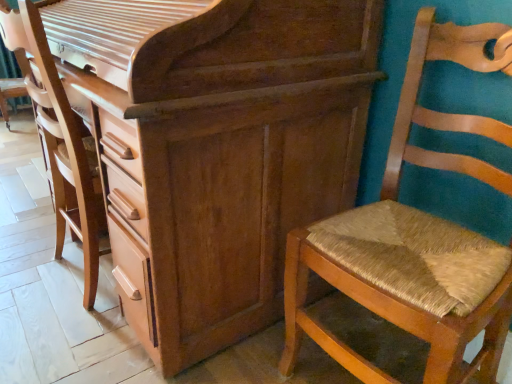
Question: Is woven straw chair at right bigger or smaller than wooden chest of drawers at center?

Choices:
 (A) small
 (B) big

Answer: (A)

Question: Is point (348, 221) positioned closer to the camera than point (230, 266)?

Choices:
 (A) closer
 (B) farther

Answer: (A)

Question: Estimate the real-world distances between objects in this image. Which object is closer to the wooden textured swivel chair at center?

Choices:
 (A) wooden chest of drawers at center
 (B) woven straw chair at right

Answer: (A)

Question: Estimate the real-world distances between objects in this image. Which object is closer to the woven straw chair at right?

Choices:
 (A) wooden textured swivel chair at center
 (B) wooden chest of drawers at center

Answer: (B)